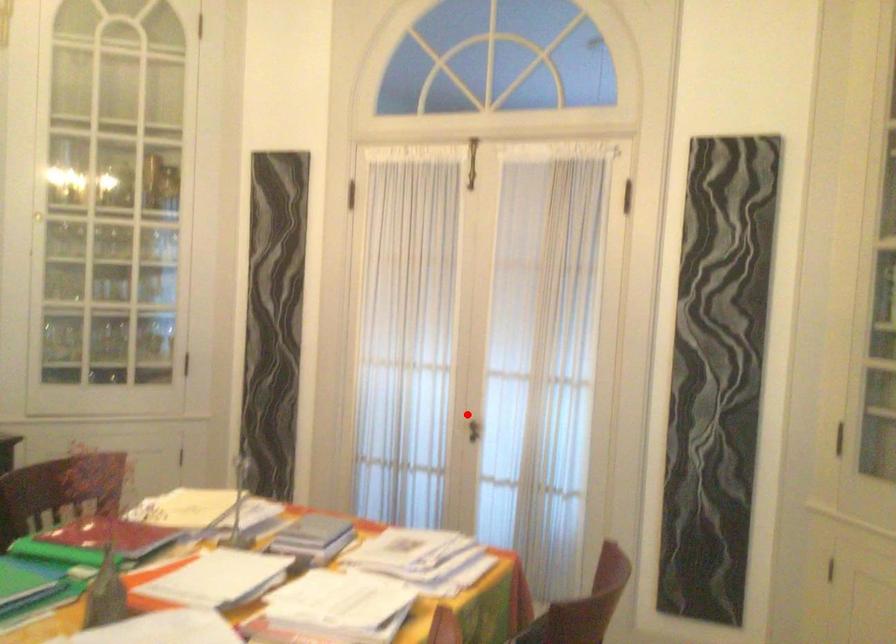
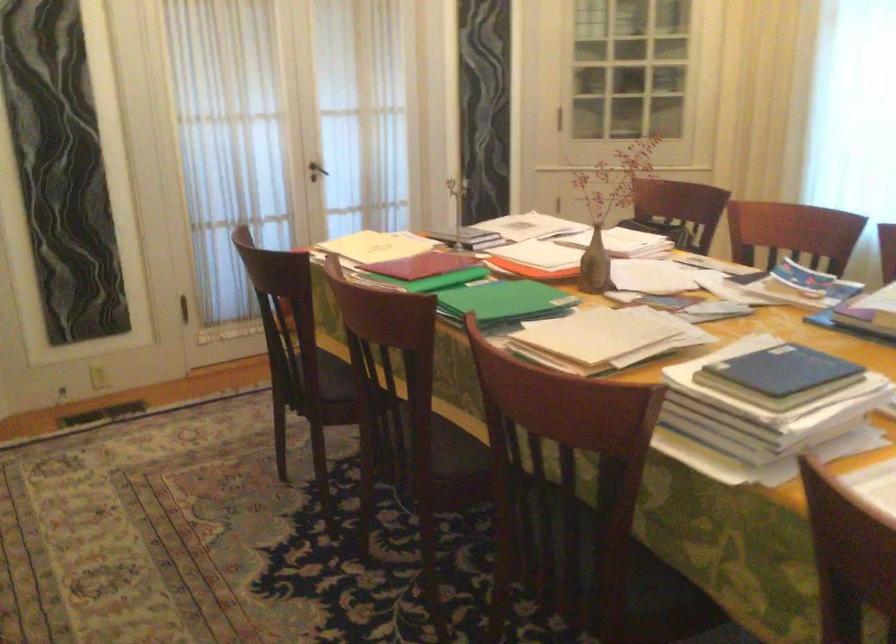
In the second image, find the point that corresponds to the highlighted location in the first image.

(316, 171)